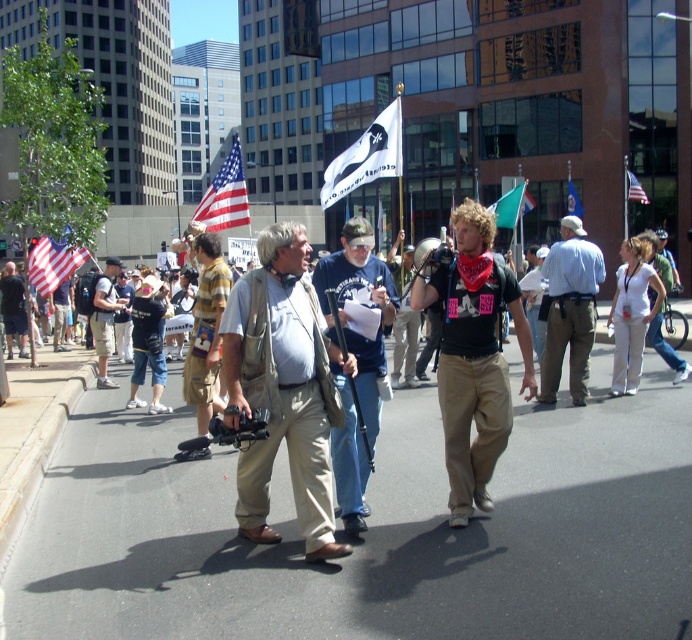
Does khaki pants at center appear on the right side of american flag at upper center?

In fact, khaki pants at center is to the left of american flag at upper center.

Does point (327, 442) come closer to viewer compared to point (641, 188)?

Yes, point (327, 442) is closer to viewer.

Is point (302, 284) closer to camera compared to point (637, 180)?

Yes, it is in front of point (637, 180).

The width and height of the screenshot is (692, 640). Find the location of `khaki pants at center`. khaki pants at center is located at coordinates (282, 388).

Is white fabric flag at center bigger than khaki shorts at center?

Indeed, white fabric flag at center has a larger size compared to khaki shorts at center.

Does point (365, 141) come farther from viewer compared to point (109, 333)?

No.

Identify the location of white fabric flag at center. The height and width of the screenshot is (640, 692). (365, 156).

From the picture: Is blue shirt at center below khaki shorts at center?

Yes.

Measure the distance from blue shirt at center to khaki shorts at center.

9.32 meters

Where is `blue shirt at center`? blue shirt at center is located at coordinates (570, 308).

Locate an element on the screen. Image resolution: width=692 pixels, height=640 pixels. blue shirt at center is located at coordinates (570, 308).